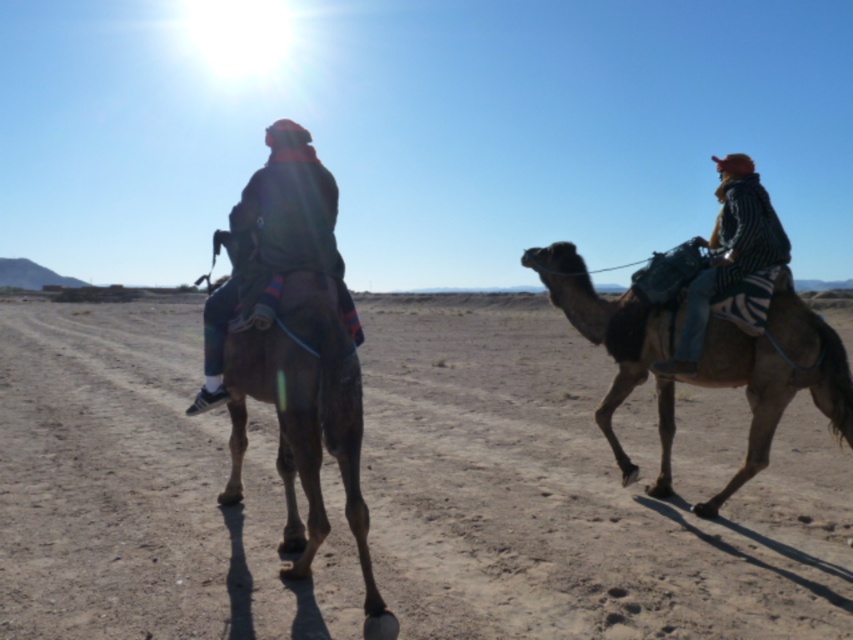
Question: Estimate the real-world distances between objects in this image. Which object is farther from the brown rough camel at left?

Choices:
 (A) dark brown leather jacket at center
 (B) striped fabric jacket at right
 (C) brown fuzzy camel at right
 (D) dusty sand track at center

Answer: (D)

Question: Which point is farther to the camera?

Choices:
 (A) (74, 392)
 (B) (366, 573)
 (C) (692, 285)

Answer: (A)

Question: Which point appears closest to the camera in this image?

Choices:
 (A) (306, 556)
 (B) (838, 406)
 (C) (695, 237)

Answer: (A)

Question: In this image, where is dusty sand track at center located relative to brown fuzzy camel at right?

Choices:
 (A) above
 (B) below

Answer: (B)

Question: In this image, where is dusty sand track at center located relative to striped fabric jacket at right?

Choices:
 (A) left
 (B) right

Answer: (A)

Question: Does brown rough camel at left have a lesser width compared to striped fabric jacket at right?

Choices:
 (A) no
 (B) yes

Answer: (A)